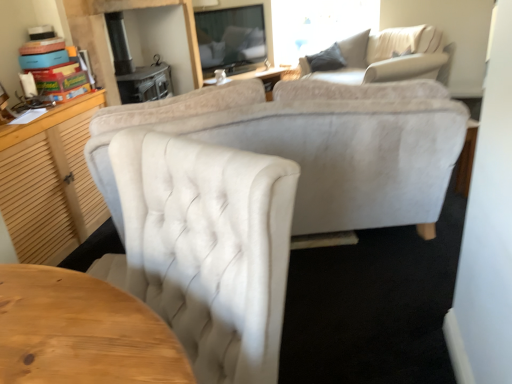
Question: In the image, is velvet white chair at center positioned in front of or behind velvet beige sofa at upper right?

Choices:
 (A) behind
 (B) front

Answer: (B)

Question: Would you say velvet white chair at center is inside or outside velvet beige sofa at upper right?

Choices:
 (A) outside
 (B) inside

Answer: (A)

Question: Considering the positions of velvet white chair at center and velvet beige sofa at upper right in the image, is velvet white chair at center taller or shorter than velvet beige sofa at upper right?

Choices:
 (A) short
 (B) tall

Answer: (B)

Question: Considering their positions, is velvet beige sofa at upper right located in front of or behind velvet white chair at center?

Choices:
 (A) behind
 (B) front

Answer: (A)

Question: In terms of height, does velvet beige sofa at upper right look taller or shorter compared to velvet white chair at center?

Choices:
 (A) short
 (B) tall

Answer: (A)

Question: In terms of width, does velvet beige sofa at upper right look wider or thinner when compared to velvet white chair at center?

Choices:
 (A) thin
 (B) wide

Answer: (B)

Question: Does point (385, 67) appear closer or farther from the camera than point (159, 309)?

Choices:
 (A) farther
 (B) closer

Answer: (A)